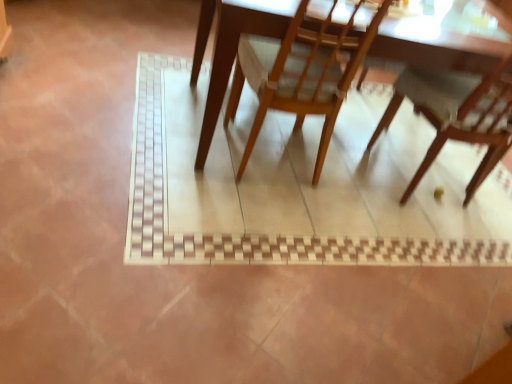
Identify the location of vacant area situated to the left side of wooden table at center. The image size is (512, 384). (112, 84).